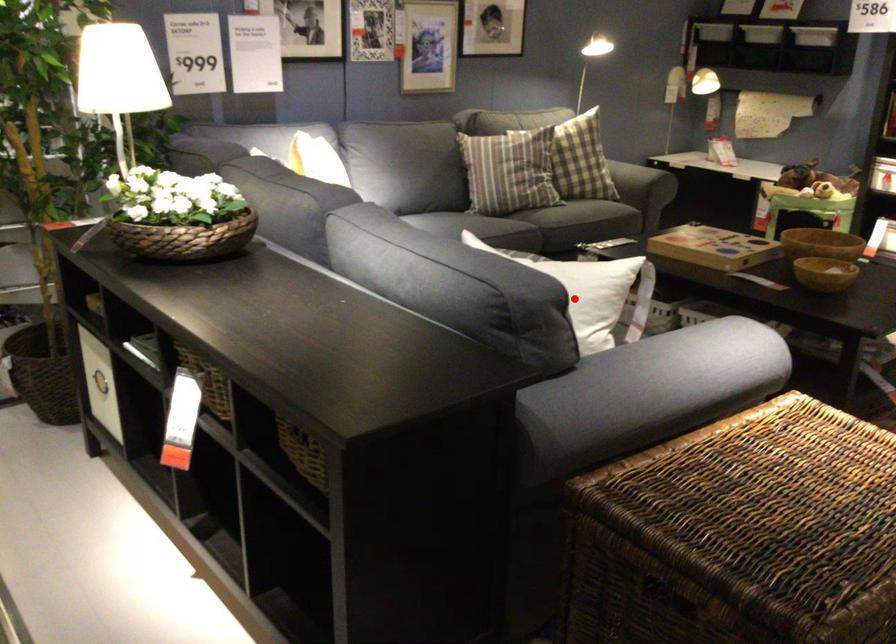
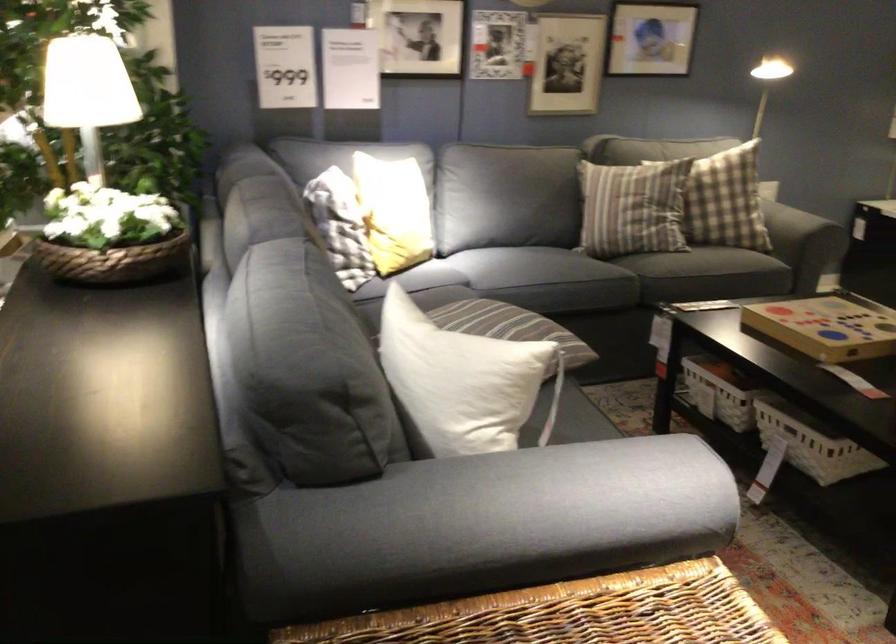
Question: I am providing you with two images of the same scene from different viewpoints. In image1, a red point is highlighted. Considering the same 3D point in image2, which of the following is correct?

Choices:
 (A) It is closer
 (B) It is farther

Answer: (A)